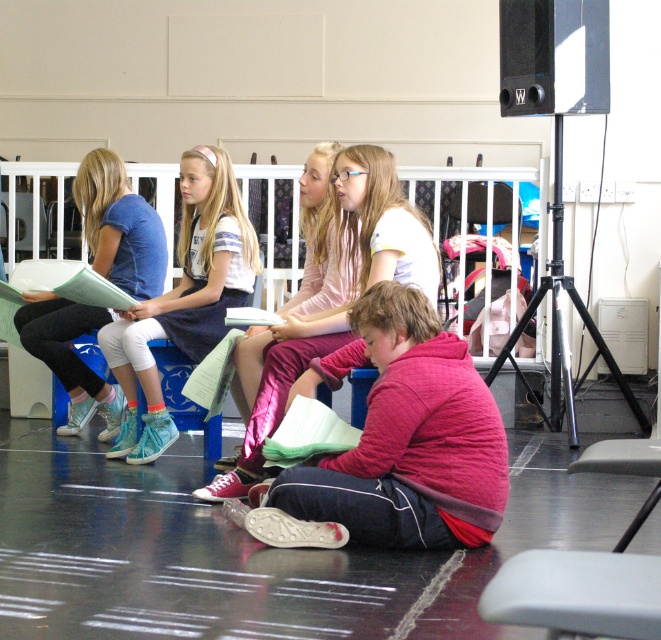
Question: Is pink quilted jacket at center to the right of matte blue shirt at left from the viewer's perspective?

Choices:
 (A) yes
 (B) no

Answer: (A)

Question: Is pink quilted jacket at center smaller than white fabric shirt at center?

Choices:
 (A) yes
 (B) no

Answer: (A)

Question: Which of the following is the closest to the observer?

Choices:
 (A) pos(235,481)
 (B) pos(182,301)
 (C) pos(399,445)
 (D) pos(126,275)

Answer: (C)

Question: Which point appears farthest from the camera in this image?

Choices:
 (A) (358, 269)
 (B) (375, 336)

Answer: (A)

Question: Which of the following is the farthest from the observer?

Choices:
 (A) matte blue shirt at left
 (B) white matte dress at upper left
 (C) white fabric shirt at center
 (D) pink quilted jacket at center

Answer: (A)

Question: Is pink quilted jacket at center bigger than white fabric shirt at center?

Choices:
 (A) no
 (B) yes

Answer: (A)